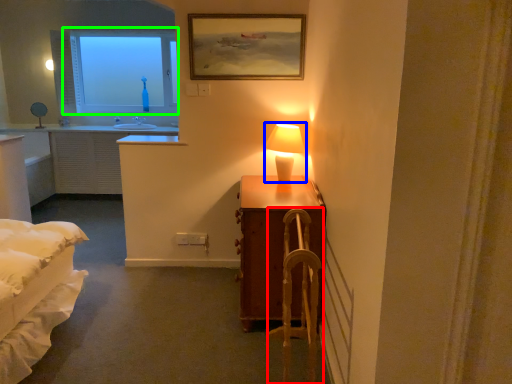
Question: Considering the real-world distances, which object is farthest from armchair (highlighted by a red box)? table lamp (highlighted by a blue box) or window (highlighted by a green box)?

Choices:
 (A) table lamp
 (B) window

Answer: (B)